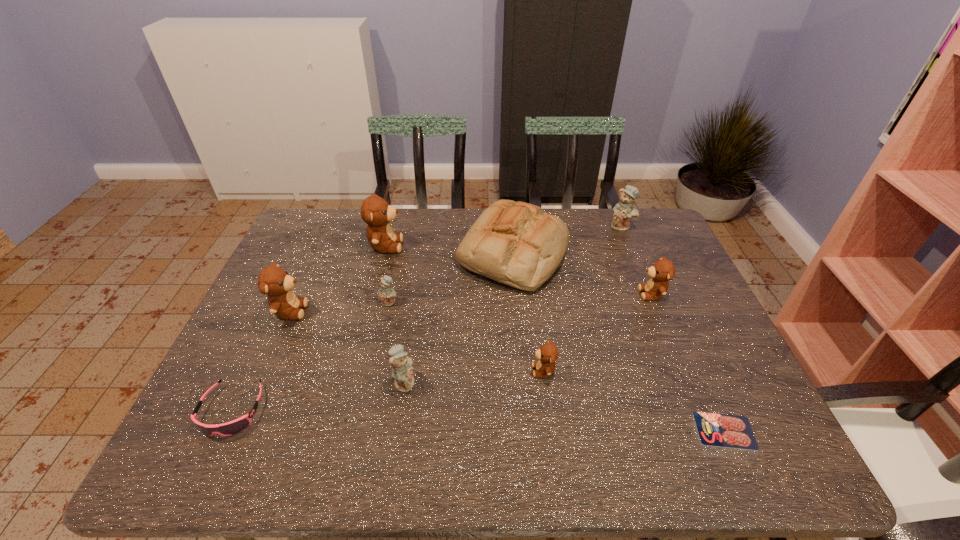
Identify the location of vacant space that's between the second biggest brown teddy bear and the bread. This screenshot has height=540, width=960. (401, 282).

Where is `vacant point located between the rightmost brown teddy bear and the shortest object`? This screenshot has height=540, width=960. vacant point located between the rightmost brown teddy bear and the shortest object is located at coordinates (688, 362).

You are a GUI agent. You are given a task and a screenshot of the screen. Output one action in this format:
    pyautogui.click(x=<x>, y=<y>)
    Task: Click on the free point between the shortest object and the farthest blue teddy bear
    
    Given the screenshot: What is the action you would take?
    pyautogui.click(x=673, y=328)

This screenshot has height=540, width=960. I want to click on the sixth closest object relative to the salami, so click(x=386, y=295).

Where is `object that is the second closest one to the bread`? object that is the second closest one to the bread is located at coordinates (623, 211).

Locate an element on the screen. teddy bear that is the fourth closest to the leftmost teddy bear is located at coordinates (548, 353).

Locate which teddy bear is the sixth closest to the third biggest brown teddy bear. Please provide its 2D coordinates. Your answer should be formatted as a tuple, i.e. [(x, y)], where the tuple contains the x and y coordinates of a point satisfying the conditions above.

[(274, 281)]

Identify the location of brown teddy bear identified as the third closest to the farthest brown teddy bear. (663, 270).

Locate which brown teddy bear ranks in proximity to the biggest brown teddy bear. Please provide its 2D coordinates. Your answer should be formatted as a tuple, i.e. [(x, y)], where the tuple contains the x and y coordinates of a point satisfying the conditions above.

[(274, 281)]

Select which blue teddy bear appears as the closest to the farthest teddy bear. Please provide its 2D coordinates. Your answer should be formatted as a tuple, i.e. [(x, y)], where the tuple contains the x and y coordinates of a point satisfying the conditions above.

[(386, 295)]